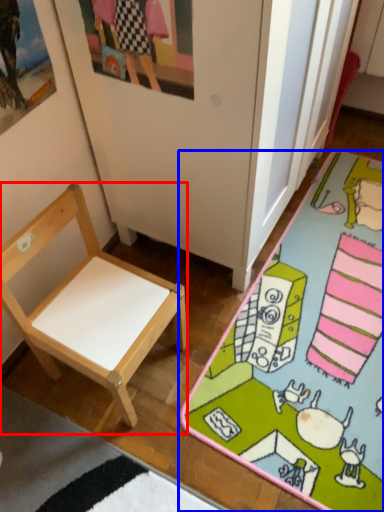
Question: Which object appears closest to the camera in this image, chair (highlighted by a red box) or desk (highlighted by a blue box)?

Choices:
 (A) chair
 (B) desk

Answer: (A)